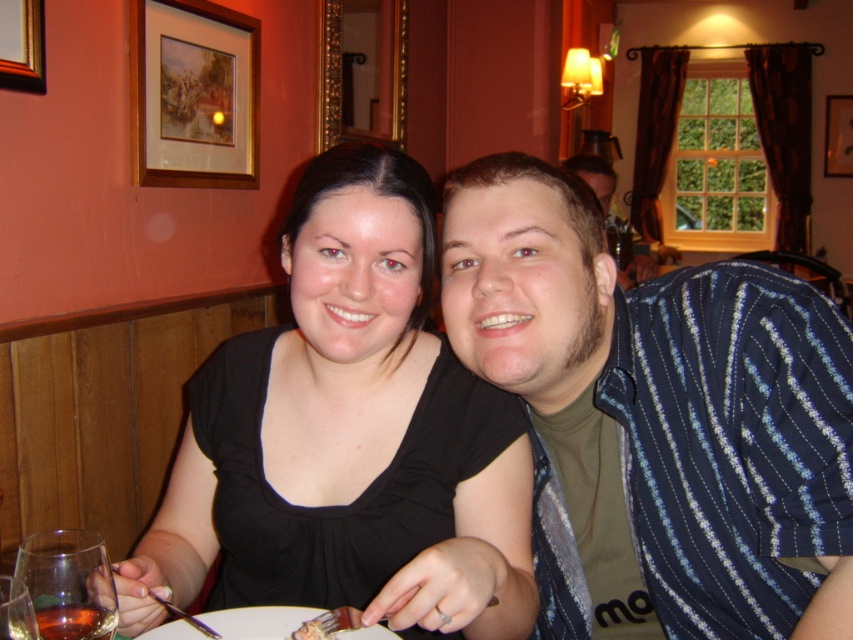
Is point (71, 616) closer to camera compared to point (851, 109)?

Yes, point (71, 616) is in front of point (851, 109).

Does amber glass at lower left have a lesser width compared to wooden picture frame at upper right?

Yes, amber glass at lower left is thinner than wooden picture frame at upper right.

Is point (44, 627) farther from viewer compared to point (850, 140)?

No, (44, 627) is in front of (850, 140).

The height and width of the screenshot is (640, 853). In order to click on amber glass at lower left in this screenshot , I will do `click(74, 621)`.

Is translucent glass wine at lower left behind blue striped shirt at upper right?

That is False.

Between translucent glass wine at lower left and blue striped shirt at upper right, which one has more height?

Standing taller between the two is blue striped shirt at upper right.

Does point (112, 592) come behind point (590, 156)?

No.

Find the location of a particular element. translucent glass wine at lower left is located at coordinates (68, 582).

Which is above, black matte shirt at center or wooden picture frame at upper left?

wooden picture frame at upper left

Does point (445, 477) lie behind point (16, 54)?

No.

You are a GUI agent. You are given a task and a screenshot of the screen. Output one action in this format:
    pyautogui.click(x=<x>, y=<y>)
    Task: Click on the black matte shirt at center
    
    Given the screenshot: What is the action you would take?
    pyautogui.click(x=351, y=435)